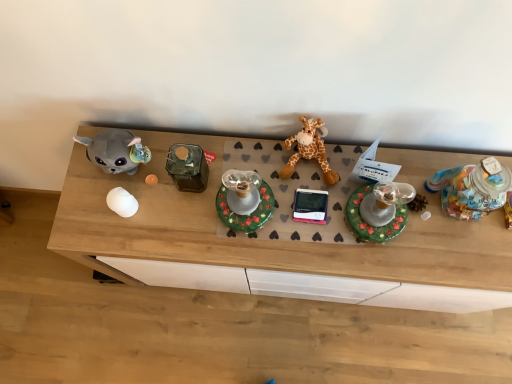
Find the location of a particular element. The image size is (512, 384). vacant space behind green matte candle holder at center, which is the third toy from right to left is located at coordinates (241, 155).